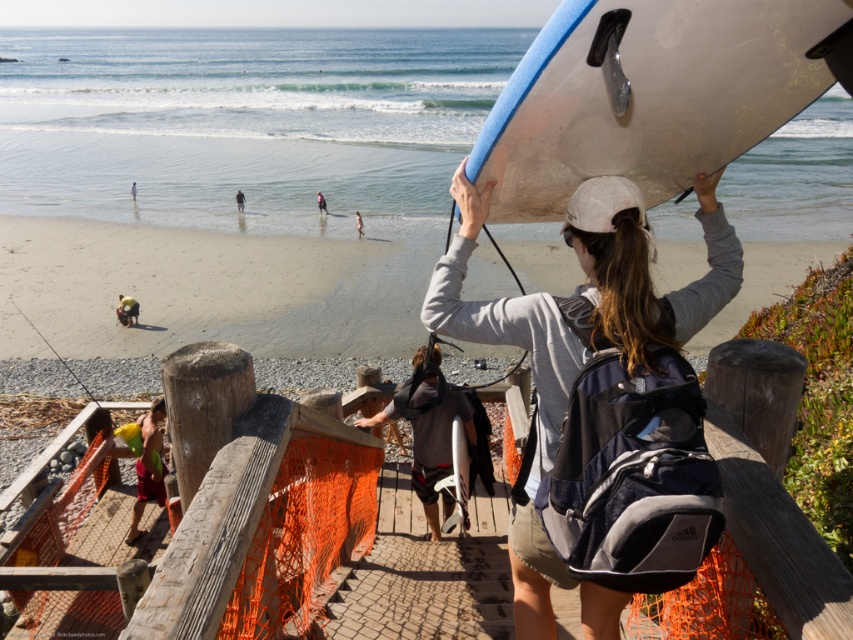
Between matte gray surfboard at upper center and dark blue wetsuit at lower center, which one has less height?

Standing shorter between the two is dark blue wetsuit at lower center.

Does matte gray surfboard at upper center appear under dark blue wetsuit at lower center?

Correct, matte gray surfboard at upper center is located below dark blue wetsuit at lower center.

Image resolution: width=853 pixels, height=640 pixels. I want to click on matte gray surfboard at upper center, so click(643, 268).

Does smooth sand beach at center have a greater width compared to matte black surfboard at upper center?

Correct, the width of smooth sand beach at center exceeds that of matte black surfboard at upper center.

Who is positioned more to the left, smooth sand beach at center or matte black surfboard at upper center?

Positioned to the left is smooth sand beach at center.

Is point (552, 262) positioned in front of point (357, 232)?

Yes, point (552, 262) is closer to viewer.

Find the location of a particular element. This screenshot has height=640, width=853. smooth sand beach at center is located at coordinates (206, 289).

In the scene shown: Is matte black surfboard at upper center further to the viewer compared to white cotton shirt at lower left?

No, it is in front of white cotton shirt at lower left.

Is the position of matte black surfboard at upper center less distant than that of white cotton shirt at lower left?

That is True.

Where is `matte black surfboard at upper center`? matte black surfboard at upper center is located at coordinates (358, 225).

Locate an element on the screen. The width and height of the screenshot is (853, 640). matte black surfboard at upper center is located at coordinates (358, 225).